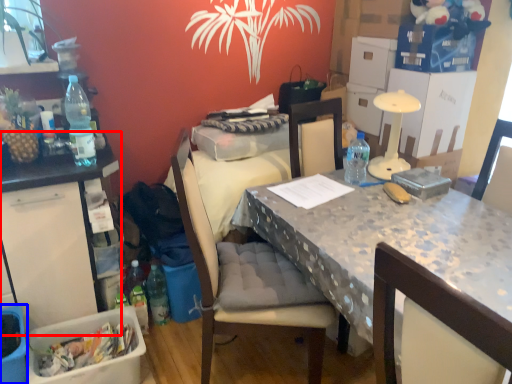
Question: Which point is further to the camera, table (highlighted by a red box) or picnic basket (highlighted by a blue box)?

Choices:
 (A) table
 (B) picnic basket

Answer: (A)